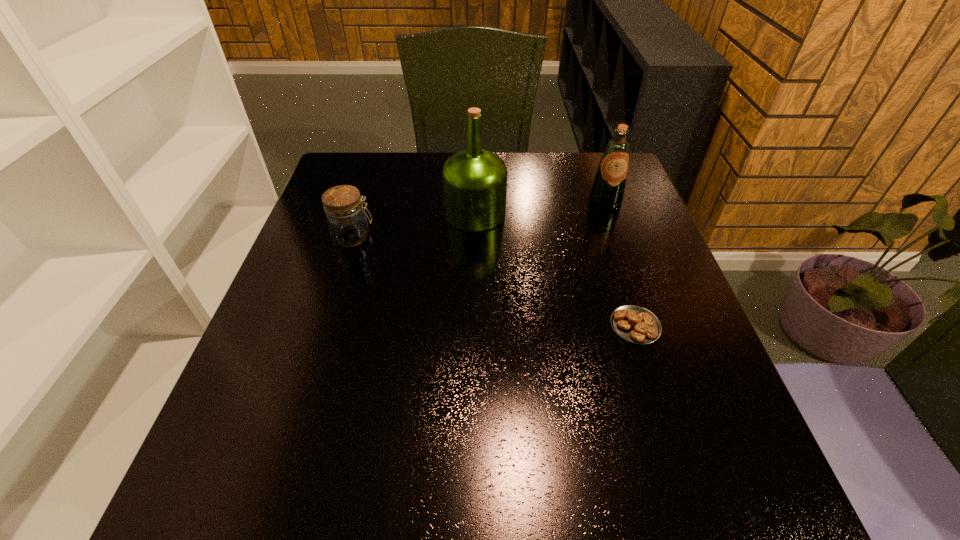
The width and height of the screenshot is (960, 540). In the image, there is a desktop. Identify the location of vacant space at the far left corner. (370, 164).

Find the location of a particular element. empty space that is in between the second object from left to right and the pastry is located at coordinates (555, 269).

This screenshot has width=960, height=540. Find the location of `free space between the third shortest object and the tallest object`. free space between the third shortest object and the tallest object is located at coordinates [x=540, y=208].

Where is `unoccupied position between the tallest object and the nearest object`? unoccupied position between the tallest object and the nearest object is located at coordinates pyautogui.click(x=555, y=269).

Where is `free space between the nearest object and the leftmost object`? free space between the nearest object and the leftmost object is located at coordinates (494, 281).

Identify the location of vacant area between the pastry and the third shortest object. The image size is (960, 540). (620, 264).

Locate an element on the screen. The height and width of the screenshot is (540, 960). unoccupied area between the shorter olive oil and the pastry is located at coordinates (620, 264).

The image size is (960, 540). What are the coordinates of `free space between the shortest object and the shorter olive oil` in the screenshot? It's located at (620, 264).

At what (x,y) coordinates should I click in order to perform the action: click on vacant space that's between the pastry and the third shortest object. Please return your answer as a coordinate pair (x, y). Image resolution: width=960 pixels, height=540 pixels. Looking at the image, I should click on (620, 264).

Where is `object that is the third nearest to the left olive oil`? object that is the third nearest to the left olive oil is located at coordinates (635, 324).